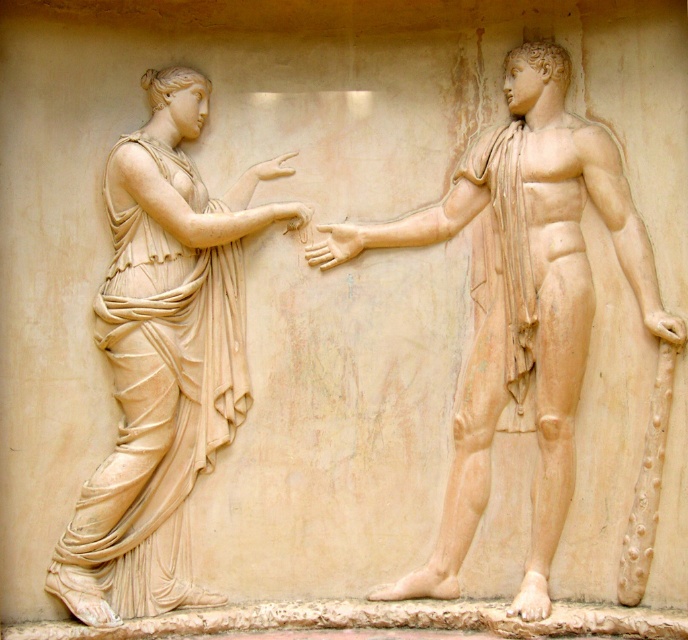
From the picture: Based on the provided scene description, where is the marble statue at right located in the image?

The marble statue at right is located at point [522,305].

You are an art conservator examining a classical relief sculpture. You notice a specific point at coordinates (522, 305) on the image. Based on the scene description, can you identify which object this point is associated with?

The point at coordinates (522, 305) corresponds to the marble statue at right.